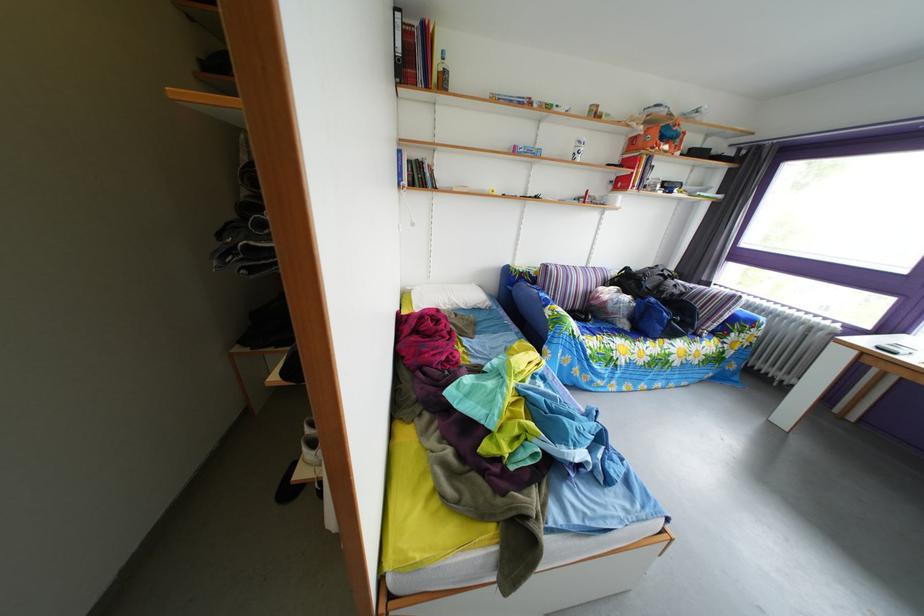
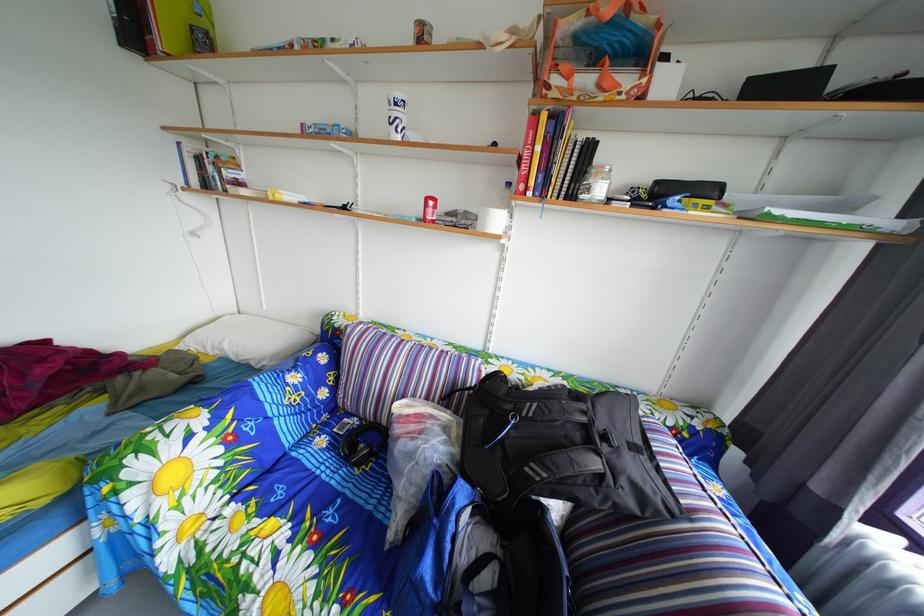
In the second image, find the point that corresponds to point 456,313 in the first image.

(224, 357)